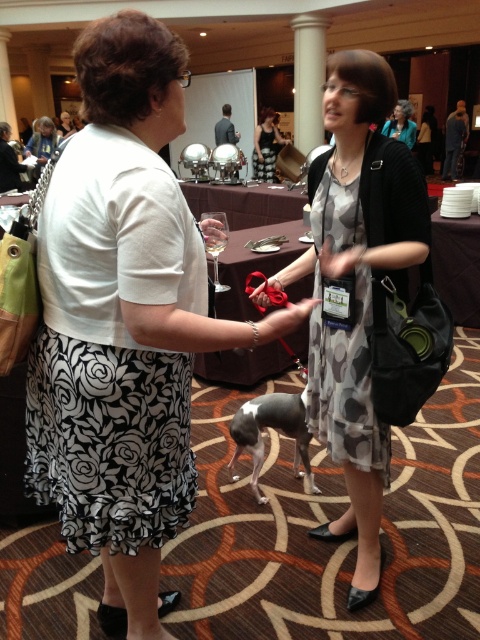
Question: Can you confirm if printed fabric dress at center is positioned to the right of clear glass wine glass at center?

Choices:
 (A) yes
 (B) no

Answer: (A)

Question: Which point is closer to the camera?

Choices:
 (A) matte black dress at center
 (B) white cotton blouse at center

Answer: (B)

Question: Which point is closer to the camera taking this photo?

Choices:
 (A) (321, 397)
 (B) (43, 253)
 (C) (210, 212)
 (D) (108, 35)

Answer: (D)

Question: Does black floral skirt at left have a smaller size compared to black floral dress at center?

Choices:
 (A) no
 (B) yes

Answer: (A)

Question: Which of the following is the farthest from the observer?

Choices:
 (A) (336, 225)
 (B) (409, 129)
 (C) (36, 500)
 (D) (208, 230)

Answer: (B)

Question: Is black floral skirt at left to the right of black floral dress at center from the viewer's perspective?

Choices:
 (A) yes
 (B) no

Answer: (B)